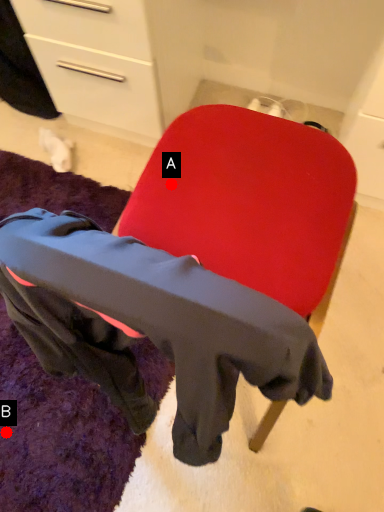
Question: Two points are circled on the image, labeled by A and B beside each circle. Which point is farther to the camera?

Choices:
 (A) A is further
 (B) B is further

Answer: (B)